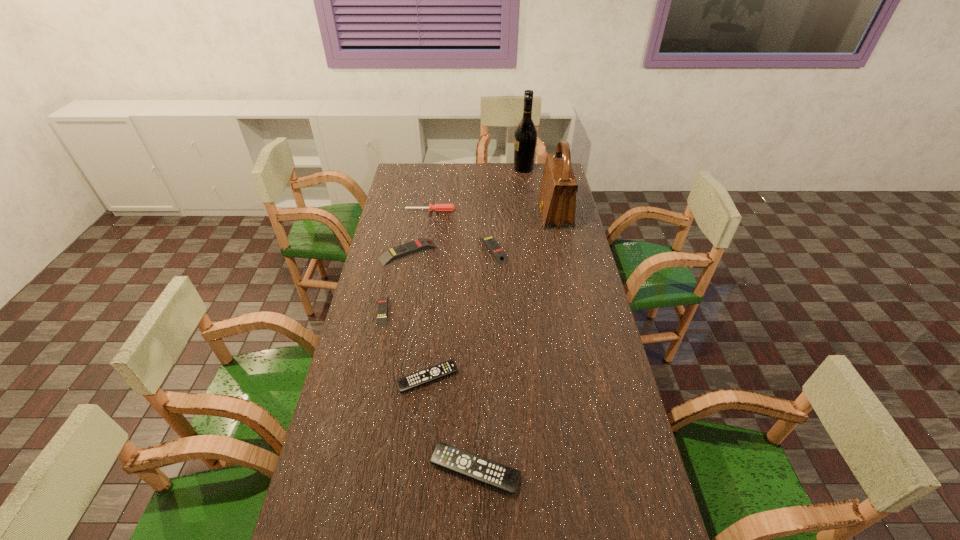
Identify the location of vacant space located on the right of the second biggest yellow remote control. This screenshot has height=540, width=960. (585, 249).

You are a GUI agent. You are given a task and a screenshot of the screen. Output one action in this format:
    pyautogui.click(x=<x>, y=<y>)
    Task: Click on the free space located 0.050m on the left of the bigger black remote control
    The height and width of the screenshot is (540, 960).
    Given the screenshot: What is the action you would take?
    pyautogui.click(x=411, y=470)

Where is `blank area located on the back of the third nearest object`? blank area located on the back of the third nearest object is located at coordinates (399, 237).

You are a GUI agent. You are given a task and a screenshot of the screen. Output one action in this format:
    pyautogui.click(x=<x>, y=<y>)
    Task: Click on the vacant space located 0.090m on the back of the farther black remote control
    
    Given the screenshot: What is the action you would take?
    pyautogui.click(x=432, y=340)

You are a GUI agent. You are given a task and a screenshot of the screen. Output one action in this format:
    pyautogui.click(x=<x>, y=<y>)
    Task: Click on the object positioned at the far edge
    Image resolution: width=960 pixels, height=540 pixels.
    Given the screenshot: What is the action you would take?
    pyautogui.click(x=525, y=138)

Image resolution: width=960 pixels, height=540 pixels. Find the location of `screwdriver present at the left edge`. screwdriver present at the left edge is located at coordinates (437, 207).

Where is `wine bottle that is at the right edge`? This screenshot has width=960, height=540. wine bottle that is at the right edge is located at coordinates tap(525, 138).

I want to click on shoulder bag that is positioned at the right edge, so click(557, 196).

Find the location of `object that is at the far right corner`. object that is at the far right corner is located at coordinates (525, 138).

In the image, there is a desktop. Identify the location of free space at the far edge. Image resolution: width=960 pixels, height=540 pixels. (501, 174).